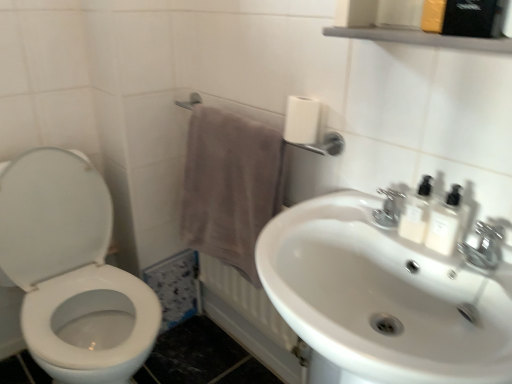
Question: Does white matte toilet paper at upper right turn towards white glossy sink at center?

Choices:
 (A) no
 (B) yes

Answer: (A)

Question: Can you confirm if white matte toilet paper at upper right is taller than white glossy sink at center?

Choices:
 (A) no
 (B) yes

Answer: (A)

Question: Is white matte toilet paper at upper right next to white glossy sink at center and touching it?

Choices:
 (A) no
 (B) yes

Answer: (A)

Question: Would you consider white matte toilet paper at upper right to be distant from white glossy sink at center?

Choices:
 (A) yes
 (B) no

Answer: (B)

Question: Is the depth of white matte toilet paper at upper right greater than that of white glossy sink at center?

Choices:
 (A) yes
 (B) no

Answer: (A)

Question: Is white glossy sink at center completely or partially inside white matte toilet paper at upper right?

Choices:
 (A) yes
 (B) no

Answer: (B)

Question: From a real-world perspective, is white opaque bottles at upper right, arranged as the 1th mouthwash when viewed from the right, over brown fabric towel at lower center?

Choices:
 (A) no
 (B) yes

Answer: (B)

Question: Can you confirm if white opaque bottles at upper right, arranged as the 1th mouthwash when viewed from the right, is smaller than brown fabric towel at lower center?

Choices:
 (A) yes
 (B) no

Answer: (A)

Question: Is white opaque bottles at upper right, which is the second mouthwash in left-to-right order, wider than brown fabric towel at lower center?

Choices:
 (A) no
 (B) yes

Answer: (B)

Question: Is the depth of white opaque bottles at upper right, arranged as the 1th mouthwash when viewed from the right, less than that of brown fabric towel at lower center?

Choices:
 (A) yes
 (B) no

Answer: (A)

Question: Is white opaque bottles at upper right, arranged as the 1th mouthwash when viewed from the right, positioned with its back to brown fabric towel at lower center?

Choices:
 (A) no
 (B) yes

Answer: (A)

Question: Is white opaque bottles at upper right, arranged as the 1th mouthwash when viewed from the right, at the left side of brown fabric towel at lower center?

Choices:
 (A) yes
 (B) no

Answer: (B)

Question: Is chrome metallic faucet at upper right positioned far away from brown fabric towel at lower center?

Choices:
 (A) no
 (B) yes

Answer: (A)